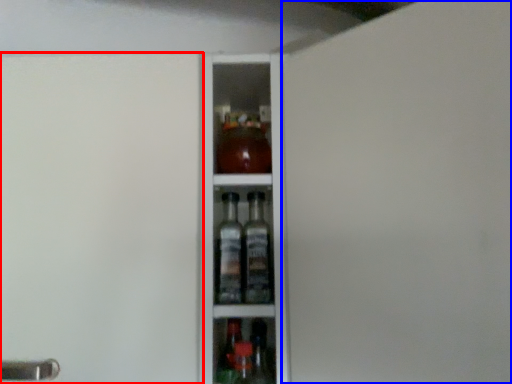
Question: Which object appears closest to the camera in this image, screen door (highlighted by a red box) or screen door (highlighted by a blue box)?

Choices:
 (A) screen door
 (B) screen door

Answer: (B)